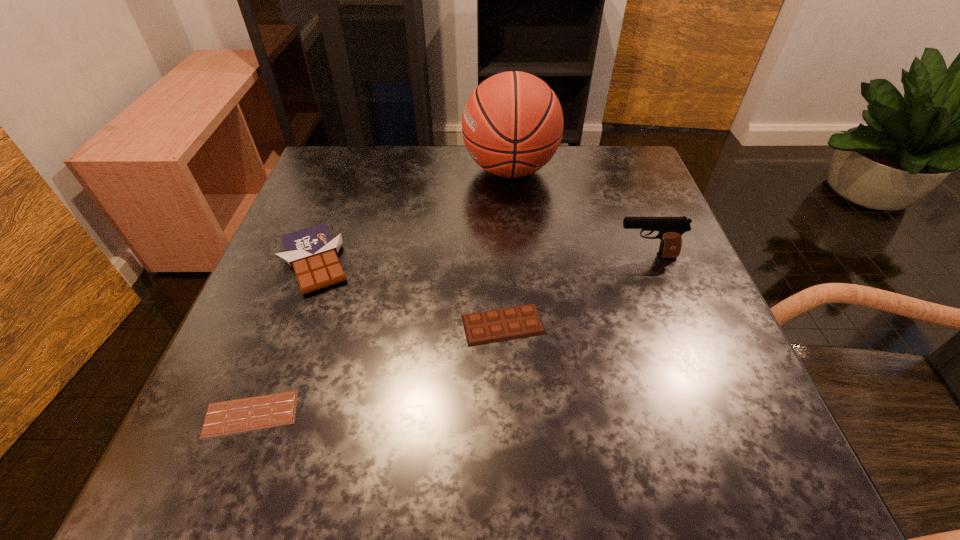
Identify the location of vacant region between the pistol and the fourth tallest object. This screenshot has height=540, width=960. click(x=575, y=291).

Locate which object is the fourth closest to the tallest object. Please provide its 2D coordinates. Your answer should be formatted as a tuple, i.e. [(x, y)], where the tuple contains the x and y coordinates of a point satisfying the conditions above.

[(254, 413)]

Where is `object that stands as the third closest to the farthest object`? The image size is (960, 540). object that stands as the third closest to the farthest object is located at coordinates click(x=498, y=325).

This screenshot has width=960, height=540. Identify the location of chocolate bar that is the closest to the tallest chocolate bar. (254, 413).

Choose which chocolate bar is the nearest neighbor to the shortest object. Please provide its 2D coordinates. Your answer should be formatted as a tuple, i.e. [(x, y)], where the tuple contains the x and y coordinates of a point satisfying the conditions above.

[(312, 252)]

Where is `free space that satisfies the following two spatial constraints: 1. on the back side of the nearest object; 2. on the left side of the farthest chocolate bar`? This screenshot has width=960, height=540. free space that satisfies the following two spatial constraints: 1. on the back side of the nearest object; 2. on the left side of the farthest chocolate bar is located at coordinates (310, 261).

Find the location of a particular element. vacant point that satisfies the following two spatial constraints: 1. at the barrel of the pistol; 2. on the front side of the tallest chocolate bar is located at coordinates (648, 261).

At what (x,y) coordinates should I click in order to perform the action: click on free space that satisfies the following two spatial constraints: 1. on the front side of the tallest chocolate bar; 2. on the left side of the second shortest object. Please return your answer as a coordinate pair (x, y). Image resolution: width=960 pixels, height=540 pixels. Looking at the image, I should click on (291, 325).